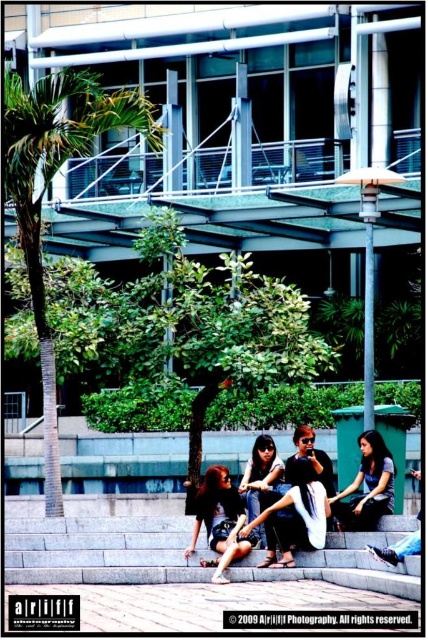
Does matte black laptop at center lie behind matte black jacket at lower right?

No.

Where is `matte black laptop at center`? matte black laptop at center is located at coordinates (294, 515).

The height and width of the screenshot is (640, 428). I want to click on matte black laptop at center, so click(294, 515).

Locate an element on the screen. denim shorts at center is located at coordinates (219, 522).

Looking at this image, is denim shorts at center thinner than matte black hair at center?

No.

The height and width of the screenshot is (640, 428). What do you see at coordinates (219, 522) in the screenshot?
I see `denim shorts at center` at bounding box center [219, 522].

This screenshot has width=428, height=640. What are the coordinates of `denim shorts at center` in the screenshot? It's located at (219, 522).

Does green leafy palm tree at left appear under denim shorts at center?

No.

Can you confirm if green leafy palm tree at left is positioned above denim shorts at center?

Correct, green leafy palm tree at left is located above denim shorts at center.

Is point (51, 449) more distant than point (228, 493)?

Yes, point (51, 449) is behind point (228, 493).

Where is `green leafy palm tree at left`? This screenshot has height=640, width=428. green leafy palm tree at left is located at coordinates (47, 186).